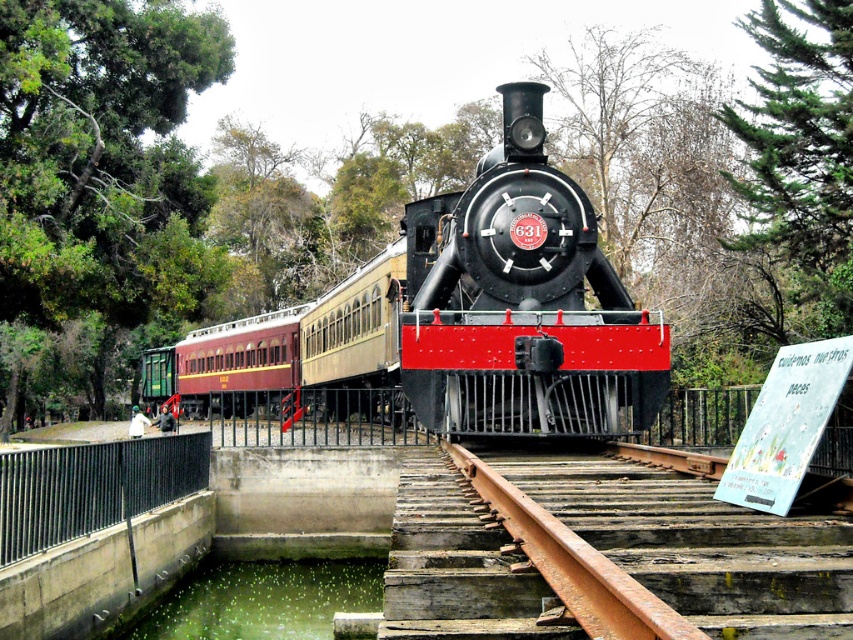
Question: Which point is farther from the camera taking this photo?

Choices:
 (A) (405, 212)
 (B) (281, 365)
 (C) (677, 614)
 (D) (242, 596)

Answer: (B)

Question: From the image, what is the correct spatial relationship of black metal fence at lower left in relation to green liquid at lower left?

Choices:
 (A) below
 (B) above

Answer: (B)

Question: Based on their relative distances, which object is farther from the black polished metal steam engine at center?

Choices:
 (A) rusty metal train track at center
 (B) green liquid at lower left

Answer: (A)

Question: Which object is farther from the camera taking this photo?

Choices:
 (A) black metal fence at lower left
 (B) black polished metal steam engine at center
 (C) maroon polished wood passenger car at center
 (D) rusty metal train track at center

Answer: (C)

Question: Considering the relative positions of maroon polished wood passenger car at center and black metal fence at lower left in the image provided, where is maroon polished wood passenger car at center located with respect to black metal fence at lower left?

Choices:
 (A) left
 (B) right

Answer: (A)

Question: Can you confirm if black metal fence at lower left is positioned above green liquid at lower left?

Choices:
 (A) no
 (B) yes

Answer: (B)